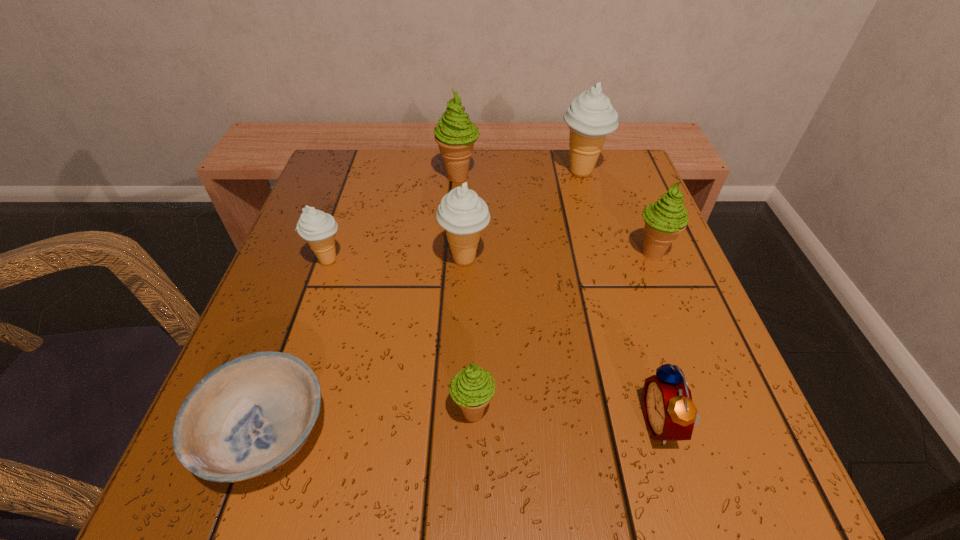
Where is `the farthest green icecream`? The width and height of the screenshot is (960, 540). the farthest green icecream is located at coordinates (455, 134).

Find the location of a particular element. the rightmost beige icecream is located at coordinates (590, 117).

Image resolution: width=960 pixels, height=540 pixels. In order to click on the farthest beige icecream in this screenshot , I will do `click(590, 117)`.

Find the location of a particular element. the second smallest green icecream is located at coordinates (665, 219).

You are a GUI agent. You are given a task and a screenshot of the screen. Output one action in this format:
    pyautogui.click(x=<x>, y=<y>)
    Task: Click on the second nearest green icecream
    
    Given the screenshot: What is the action you would take?
    pyautogui.click(x=665, y=219)

I want to click on the second biggest beige icecream, so click(462, 213).

Find the location of `the leftmost icecream`. the leftmost icecream is located at coordinates point(318,228).

Find the location of a particular element. Image resolution: width=960 pixels, height=540 pixels. the leftmost beige icecream is located at coordinates pyautogui.click(x=318, y=228).

Where is `the smallest green icecream`? The image size is (960, 540). the smallest green icecream is located at coordinates (472, 388).

Identify the location of the nearest green icecream. The image size is (960, 540). (472, 388).